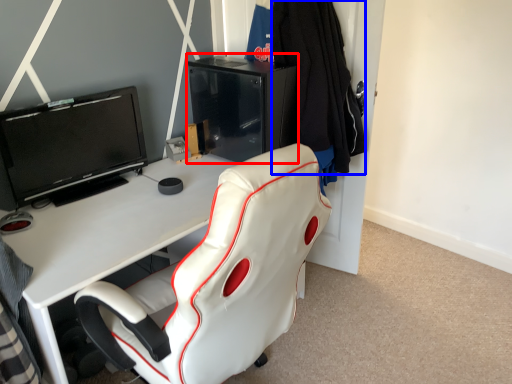
Question: Which point is closer to the camera, file cabinet (highlighted by a red box) or clothing (highlighted by a blue box)?

Choices:
 (A) file cabinet
 (B) clothing

Answer: (B)